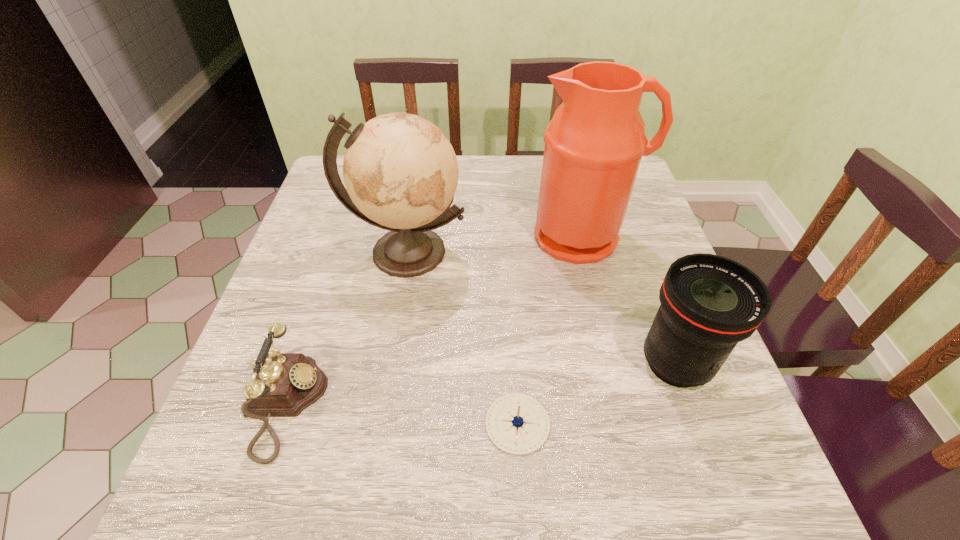
Where is `water jug`? The height and width of the screenshot is (540, 960). water jug is located at coordinates (594, 143).

Locate an element on the screen. This screenshot has width=960, height=540. globe is located at coordinates (400, 171).

This screenshot has height=540, width=960. What are the coordinates of `the third shortest object` in the screenshot? It's located at (709, 303).

Identify the location of telephone. (283, 384).

Identify the location of the third object from left to right. This screenshot has width=960, height=540. (518, 424).

Locate an element on the screen. The image size is (960, 540). compass is located at coordinates (518, 424).

The width and height of the screenshot is (960, 540). Find the location of `vacant space located from the spout of the water jug`. vacant space located from the spout of the water jug is located at coordinates (608, 339).

At what (x,y) coordinates should I click in order to perform the action: click on blank area located on the front-facing side of the globe. Please return your answer as a coordinate pair (x, y). The width and height of the screenshot is (960, 540). Looking at the image, I should click on (377, 423).

In order to click on vacant space situated 0.110m on the front of the telephoto lens in this screenshot , I will do `click(710, 462)`.

The image size is (960, 540). I want to click on vacant space located 0.110m on the dial of the telephone, so click(384, 404).